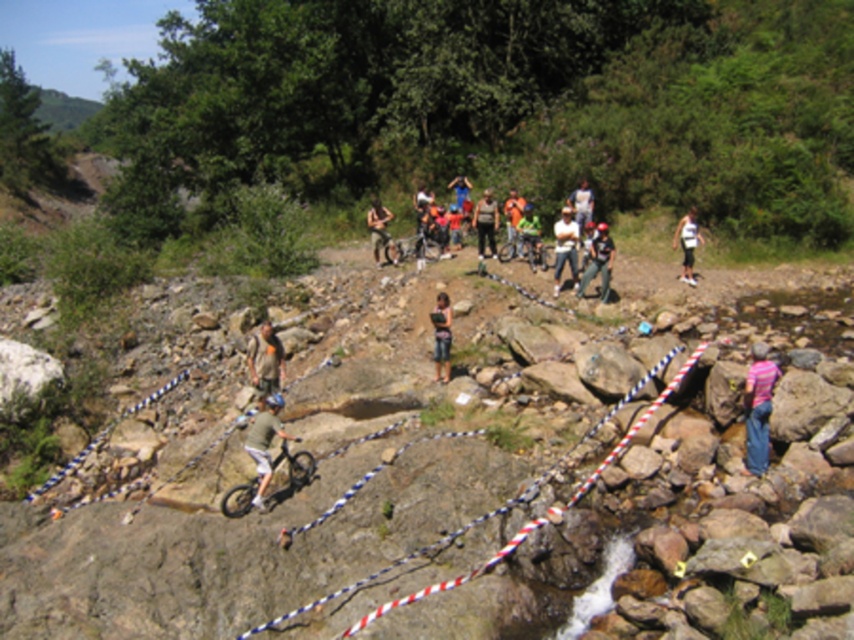
Question: From the image, what is the correct spatial relationship of green fabric shorts at center in relation to dark gray shirt at center?

Choices:
 (A) right
 (B) left

Answer: (B)

Question: Does white striped rope at center appear on the left side of camouflage pants at center?

Choices:
 (A) yes
 (B) no

Answer: (B)

Question: Is green fabric shorts at center above denim pants at center?

Choices:
 (A) no
 (B) yes

Answer: (A)

Question: Which of the following is the closest to the observer?

Choices:
 (A) dark gray shirt at center
 (B) blue jeans at center

Answer: (B)

Question: Which object is the closest to the white matte shirt at center?

Choices:
 (A) blue jeans at center
 (B) green matte mountain bike at center

Answer: (B)

Question: Which point appears closest to the camera in this image?

Choices:
 (A) (761, 360)
 (B) (554, 289)
 (C) (609, 260)

Answer: (A)